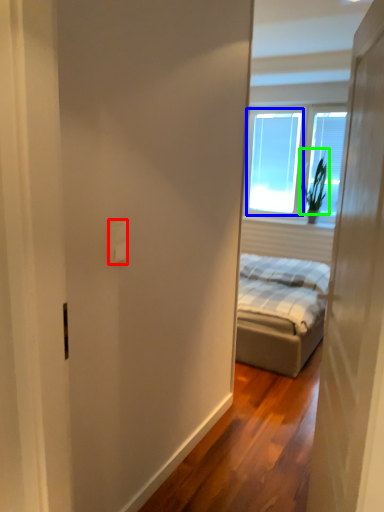
Question: Which object is positioned closest to electric outlet (highlighted by a red box)? Select from window screen (highlighted by a blue box) and plant (highlighted by a green box).

Choices:
 (A) window screen
 (B) plant

Answer: (B)